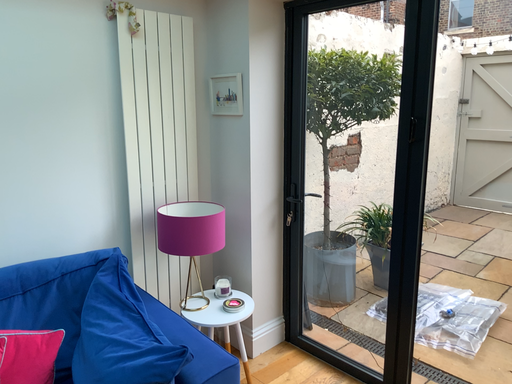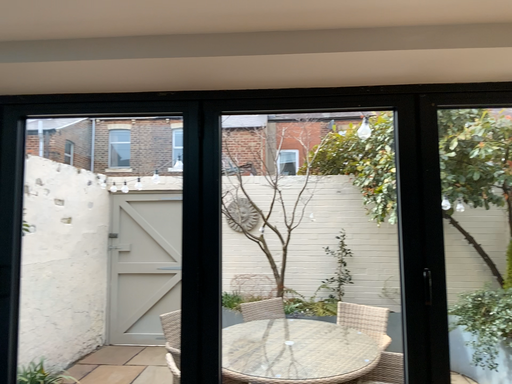
Question: Which way did the camera rotate in the video?

Choices:
 (A) rotated downward
 (B) rotated upward

Answer: (B)